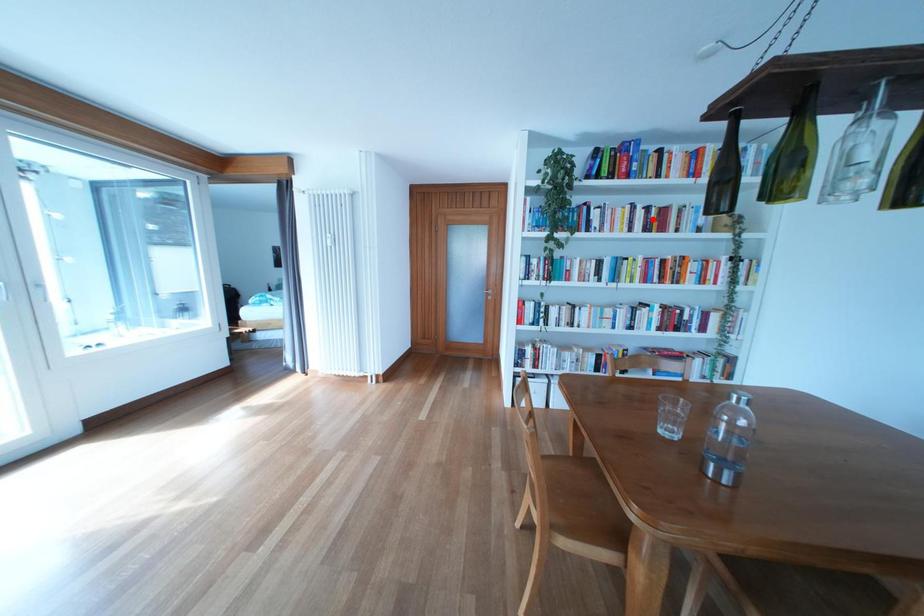
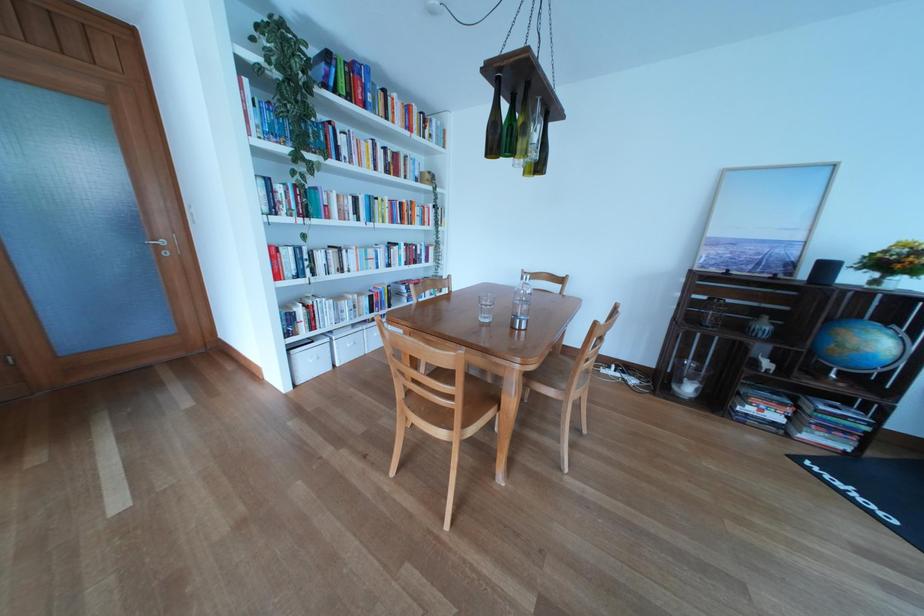
Where in the second image is the point corresponding to the highlighted location from the first image?

(394, 159)